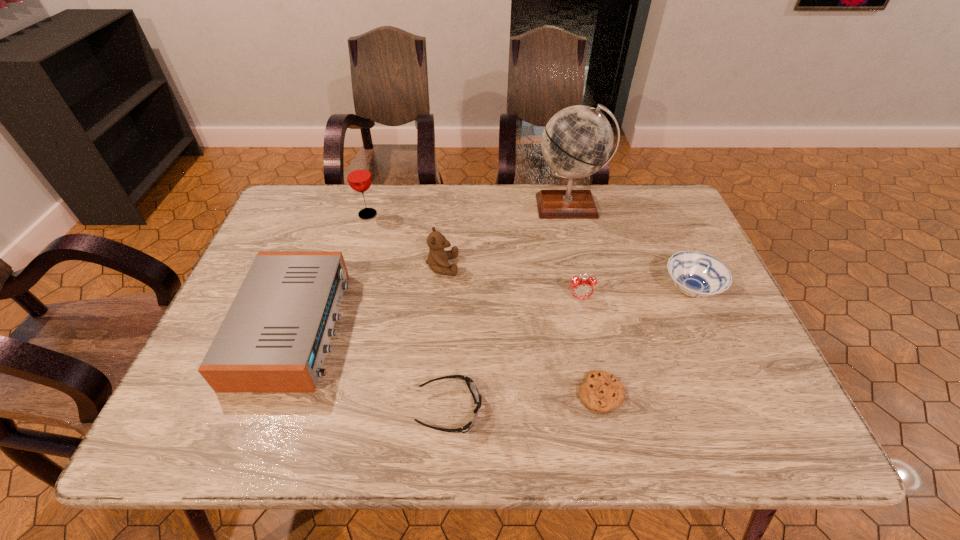
In order to click on free location located 0.090m on the right of the second tallest object in this screenshot , I will do `click(409, 214)`.

The width and height of the screenshot is (960, 540). What are the coordinates of `vacant space located 0.290m on the front-facing side of the teddy bear` in the screenshot? It's located at (567, 266).

You are a GUI agent. You are given a task and a screenshot of the screen. Output one action in this format:
    pyautogui.click(x=<x>, y=<y>)
    Task: Click on the free space located 0.310m on the face of the alarm clock
    The width and height of the screenshot is (960, 540).
    Given the screenshot: What is the action you would take?
    pyautogui.click(x=606, y=421)

At what (x,y) coordinates should I click in order to perform the action: click on free spot located 0.220m on the front panel of the radio receiver. Please return your answer as a coordinate pair (x, y). The height and width of the screenshot is (540, 960). Looking at the image, I should click on (435, 327).

The image size is (960, 540). In order to click on blank area located 0.350m on the back of the rightmost object in this screenshot , I will do `click(646, 192)`.

Locate an element on the screen. free region located 0.250m on the lenses of the sunglasses is located at coordinates (606, 410).

Where is `vacant space positioned on the back of the cookie`? The image size is (960, 540). vacant space positioned on the back of the cookie is located at coordinates (590, 346).

The height and width of the screenshot is (540, 960). In order to click on globe located in the far edge section of the desktop in this screenshot , I will do `click(577, 141)`.

This screenshot has height=540, width=960. I want to click on glass present at the far edge, so click(359, 177).

The height and width of the screenshot is (540, 960). In order to click on sunglasses that is positioned at the near edge in this screenshot , I will do `click(470, 383)`.